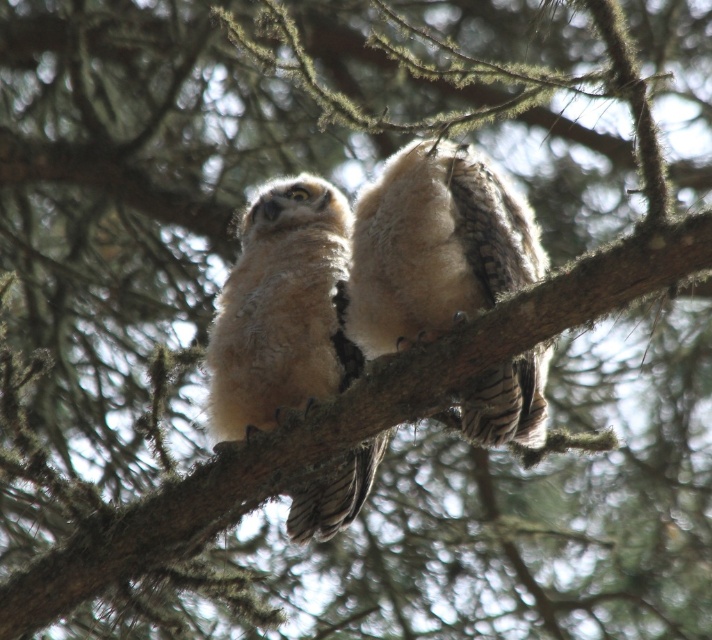
You are a birdwatcher trying to capture both the fuzzy white owl at center and the fuzzy beige owl at center in a single photo. Given that your camera has a maximum focus range of 12 inches, will you be able to include both owls in the photo without moving the camera?

The fuzzy white owl at center and the fuzzy beige owl at center are 12.44 inches apart. Since your camera can only focus up to 12 inches, the distance between them exceeds the maximum focus range. Therefore, you won cannot include both owls in the photo without moving the camera.

You are a birdwatcher observing two baby owls on a tree branch. You notice the fuzzy white owl at center and the fuzzy beige owl at center. Which of these two owls is taller?

The fuzzy white owl at center is shorter than the fuzzy beige owl at center, so the fuzzy beige owl at center is taller.

Based on the photo, you are a birdwatcher trying to locate the fuzzy white owl at center in the image. The coordinates given are in a normalized system where the bottom left corner is the origin. Can you determine if the point at (434,244) is the correct location for the fuzzy white owl at center?

The fuzzy white owl at center is represented by point (434,244), so yes, the coordinates are correct.